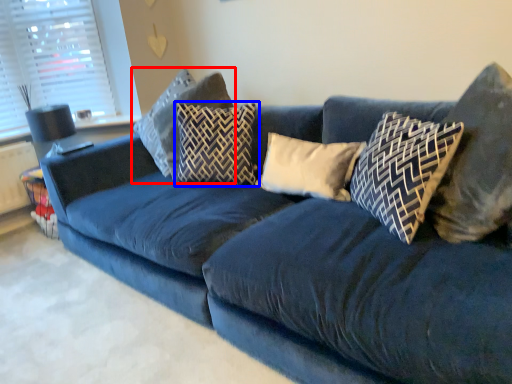
Question: Among these objects, which one is nearest to the camera, pillow (highlighted by a red box) or pillow (highlighted by a blue box)?

Choices:
 (A) pillow
 (B) pillow

Answer: (B)